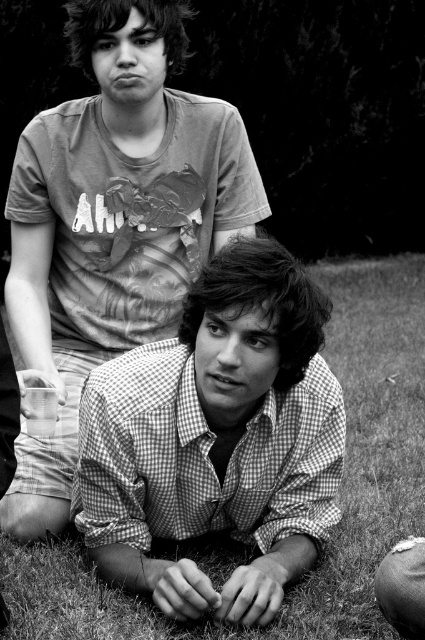
Based on the scene described, which object, the checkered fabric shirt at lower center or the grassy lawn at lower center, occupies a larger area in the image?

The checkered fabric shirt at lower center is bigger than the grassy lawn at lower center, so it occupies a larger area in the image.